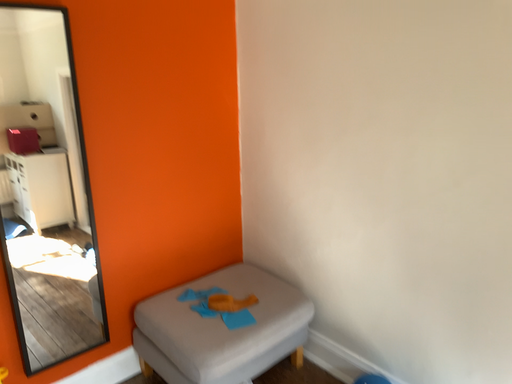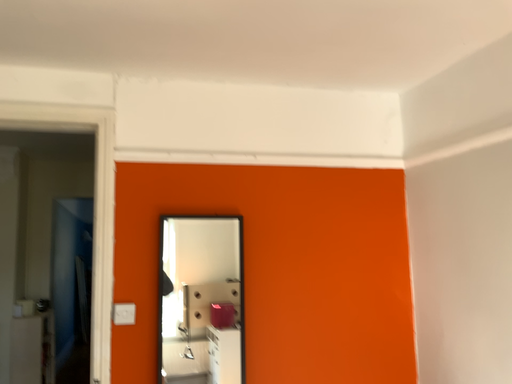
Question: How did the camera likely rotate when shooting the video?

Choices:
 (A) rotated downward
 (B) rotated upward

Answer: (B)